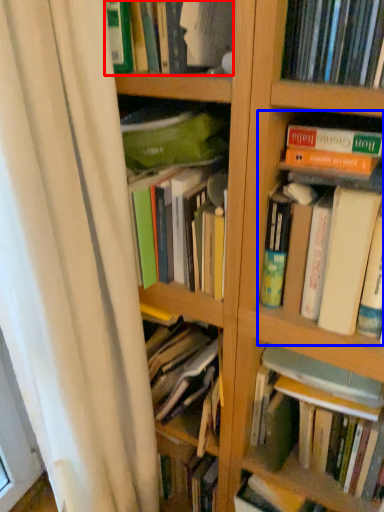
Question: Among these objects, which one is farthest to the camera, book (highlighted by a red box) or book (highlighted by a blue box)?

Choices:
 (A) book
 (B) book

Answer: (A)